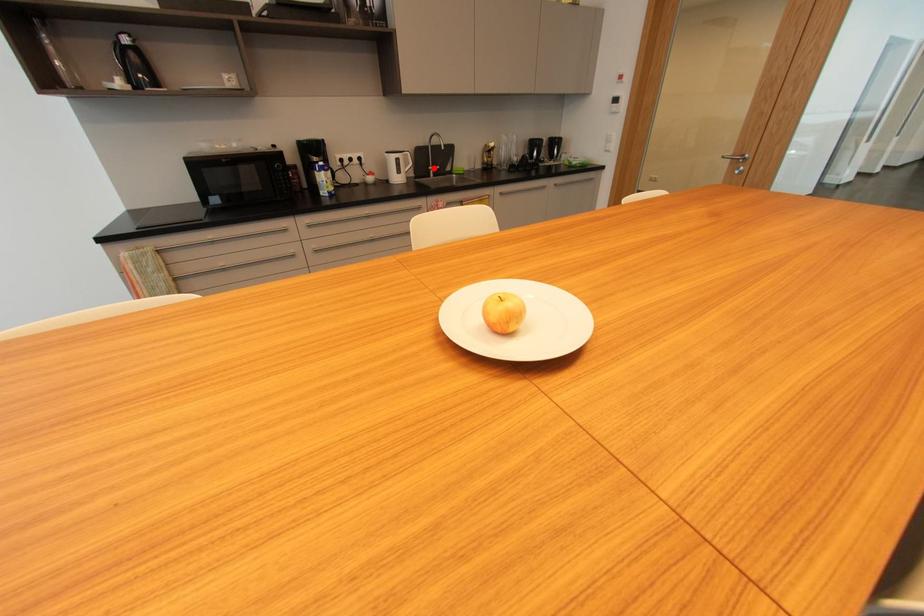
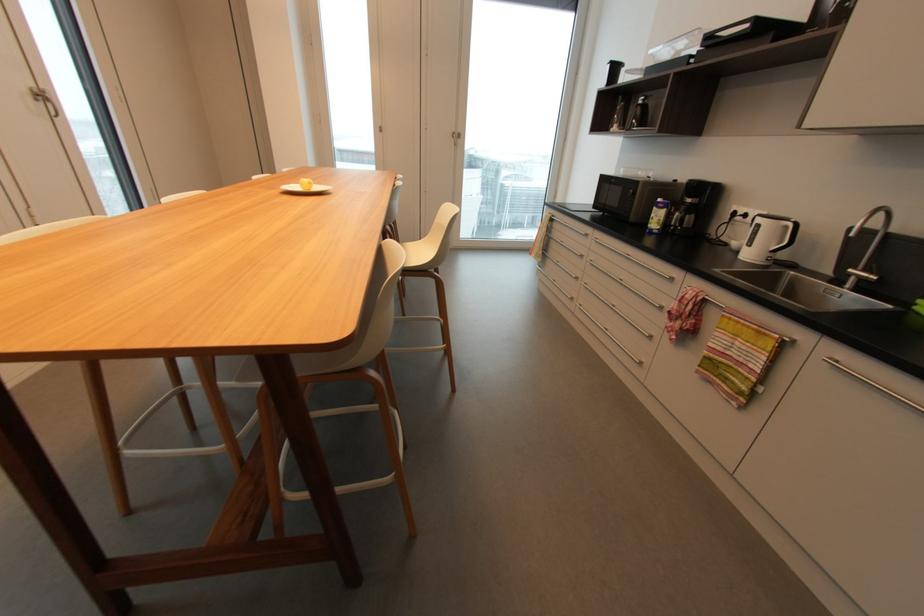
Question: I am providing you with two images of the same scene from different viewpoints. A red point is marked on the first image. Is the red point's position out of view in image 2?

Choices:
 (A) Yes
 (B) No

Answer: (B)